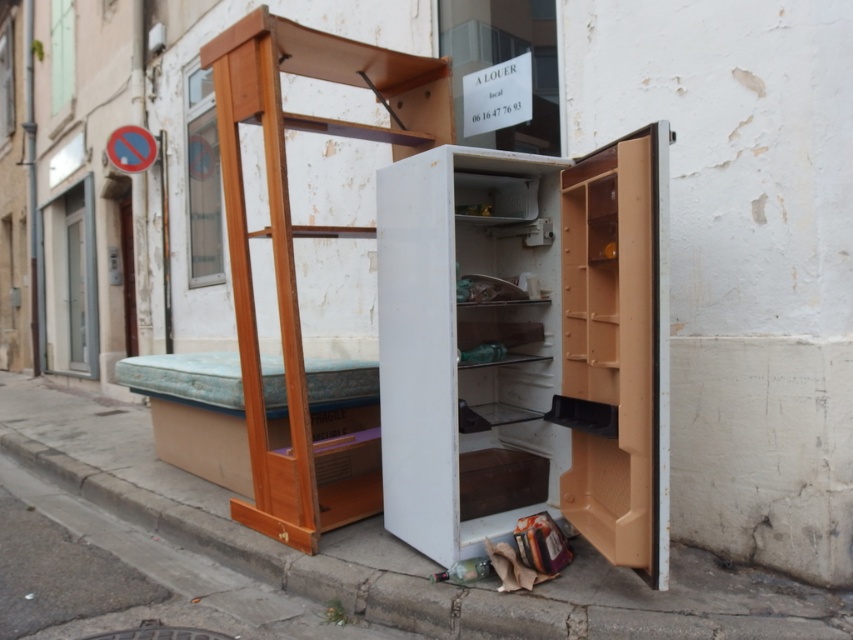
Who is shorter, white plastic refrigerator at center or white concrete pavement at lower center?

white concrete pavement at lower center

Is white plastic refrigerator at center below white concrete pavement at lower center?

Incorrect, white plastic refrigerator at center is not positioned below white concrete pavement at lower center.

Is point (450, 188) less distant than point (672, 557)?

Yes, it is.

This screenshot has width=853, height=640. What are the coordinates of `white plastic refrigerator at center` in the screenshot? It's located at (525, 348).

Is white plastic refrigerator at center to the right of wooden ladder at left from the viewer's perspective?

Indeed, white plastic refrigerator at center is positioned on the right side of wooden ladder at left.

Is white plastic refrigerator at center below wooden ladder at left?

Yes, white plastic refrigerator at center is below wooden ladder at left.

Describe the element at coordinates (525, 348) in the screenshot. I see `white plastic refrigerator at center` at that location.

At what (x,y) coordinates should I click in order to perform the action: click on white plastic refrigerator at center. Please return your answer as a coordinate pair (x, y). Looking at the image, I should click on tap(525, 348).

Identify the location of white concrete pavement at lower center. The width and height of the screenshot is (853, 640). (396, 548).

Does white concrete pavement at lower center appear on the left side of wooden ladder at left?

Yes, white concrete pavement at lower center is to the left of wooden ladder at left.

Is point (390, 618) positioned behind point (252, 387)?

That is False.

Identify the location of white concrete pavement at lower center. The height and width of the screenshot is (640, 853). (396, 548).